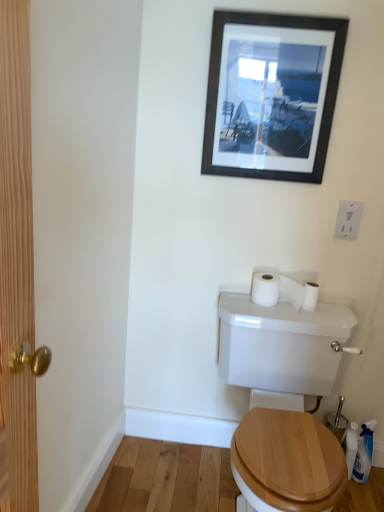
Question: From the image's perspective, relative to white glossy toilet at center, is white matte toilet paper at upper right, the 2th toilet paper positioned from the left, above or below?

Choices:
 (A) below
 (B) above

Answer: (B)

Question: Is white matte toilet paper at upper right, the 2th toilet paper positioned from the left, bigger or smaller than white glossy toilet at center?

Choices:
 (A) small
 (B) big

Answer: (A)

Question: Which of these objects is positioned farthest from the black matte picture frame at upper center?

Choices:
 (A) white matte toilet paper at upper right, positioned as the first toilet paper in right-to-left order
 (B) white plastic switch at upper right
 (C) white matte toilet paper at upper right, the first toilet paper from the left
 (D) white glossy toilet at center

Answer: (D)

Question: Which is farther from the white matte toilet paper at upper right, positioned as the first toilet paper in right-to-left order?

Choices:
 (A) white glossy toilet at center
 (B) white matte toilet paper at upper right, the first toilet paper from the left
 (C) white plastic switch at upper right
 (D) black matte picture frame at upper center

Answer: (D)